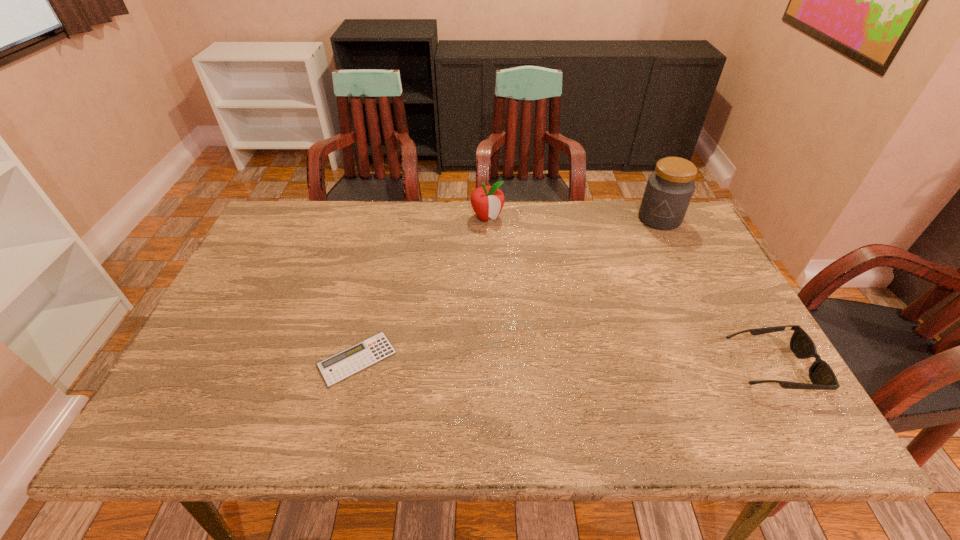
The width and height of the screenshot is (960, 540). Identify the location of the shortest object. (368, 352).

The width and height of the screenshot is (960, 540). Identify the location of the leftmost object. (368, 352).

Find the location of a particular element. This screenshot has width=960, height=540. sunglasses is located at coordinates (821, 375).

Find the location of `apple`. apple is located at coordinates (487, 201).

The height and width of the screenshot is (540, 960). What are the coordinates of `the second object from left to right` in the screenshot? It's located at (487, 201).

This screenshot has height=540, width=960. What are the coordinates of `jar` in the screenshot? It's located at (669, 189).

The width and height of the screenshot is (960, 540). Identify the location of vacant region located on the left of the shortest object. [x=259, y=359].

Find the location of a particular element. The height and width of the screenshot is (540, 960). vacant space located 0.200m on the side where a bite is taken out of the second object from left to right is located at coordinates (517, 266).

The height and width of the screenshot is (540, 960). Identify the location of vacant area located on the side where a bite is taken out of the second object from left to right. (544, 310).

In order to click on vacant space situated on the side where a bite is taken out of the second object from left to right in this screenshot , I will do `click(516, 264)`.